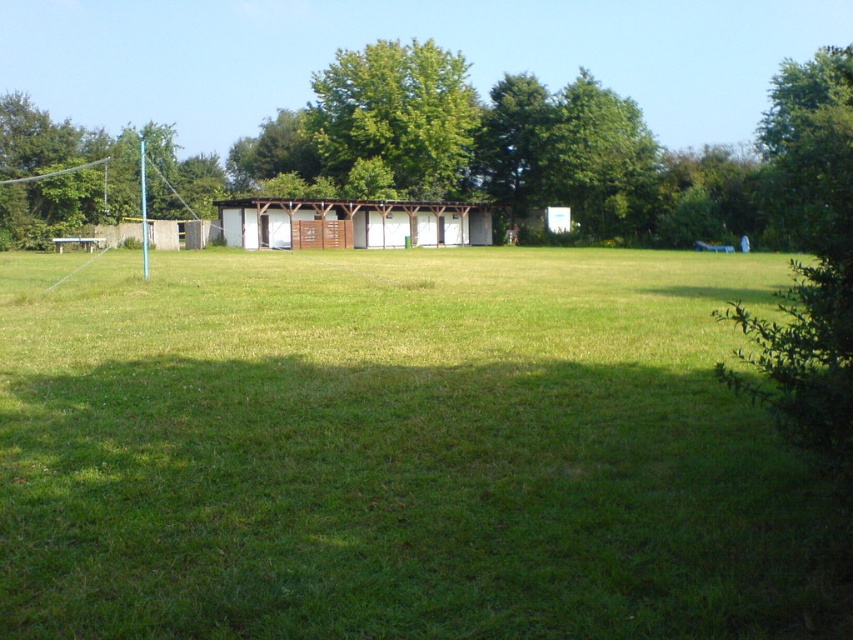
Question: Which of the following is the closest to the observer?

Choices:
 (A) green leafy tree at center
 (B) green grassy field at center
 (C) wooden shed at center
 (D) green leafy tree at left

Answer: (B)

Question: Among these points, which one is nearest to the camera?

Choices:
 (A) (532, 525)
 (B) (22, 227)
 (C) (456, 218)
 (D) (445, 195)

Answer: (A)

Question: Is the position of green grassy field at center less distant than that of green leafy tree at left?

Choices:
 (A) yes
 (B) no

Answer: (A)

Question: Estimate the real-world distances between objects in this image. Which object is farther from the wooden shed at center?

Choices:
 (A) green leafy tree at center
 (B) green leafy tree at left

Answer: (B)

Question: Does green leafy tree at center lie behind green leafy tree at left?

Choices:
 (A) yes
 (B) no

Answer: (A)

Question: Can you confirm if green leafy tree at left is wider than wooden shed at center?

Choices:
 (A) yes
 (B) no

Answer: (A)